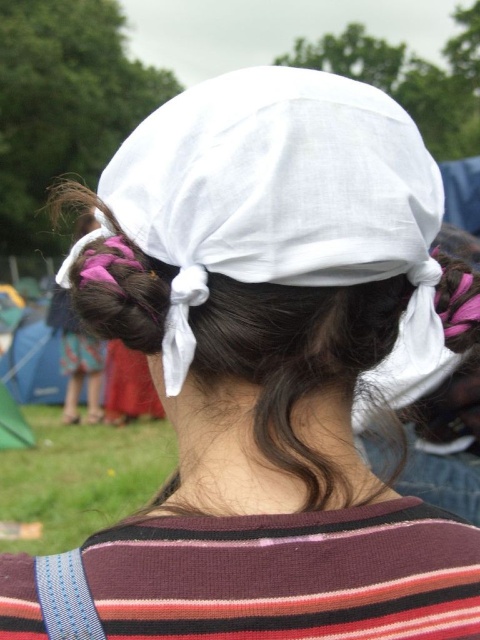
Question: Among these objects, which one is nearest to the camera?

Choices:
 (A) white cotton headscarf at center
 (B) white cloth at center

Answer: (A)

Question: Is white cotton headscarf at center positioned behind white cloth at center?

Choices:
 (A) no
 (B) yes

Answer: (A)

Question: Does white cotton headscarf at center appear on the left side of white cloth at center?

Choices:
 (A) yes
 (B) no

Answer: (A)

Question: Is white cotton headscarf at center to the left of white cloth at center from the viewer's perspective?

Choices:
 (A) no
 (B) yes

Answer: (B)

Question: Which object is closer to the camera taking this photo?

Choices:
 (A) white cotton headscarf at center
 (B) white cloth at center

Answer: (A)

Question: Which point is closer to the camera taking this photo?

Choices:
 (A) (241, 269)
 (B) (442, 227)

Answer: (A)